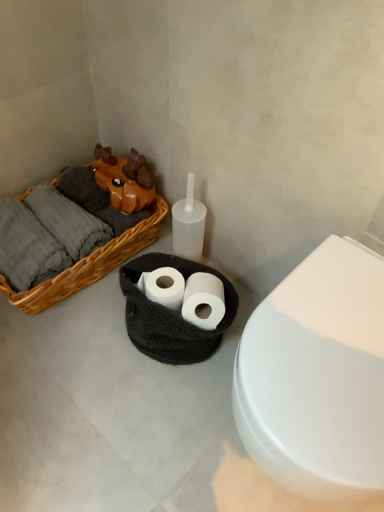
Find the location of `free space above white glossy toilet at center right (from a real-world perspective)`. free space above white glossy toilet at center right (from a real-world perspective) is located at coordinates (332, 330).